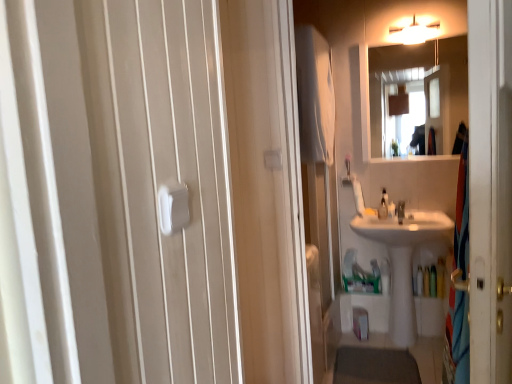
I want to click on free point below white glossy sink at center (from a real-world perspective), so click(x=411, y=347).